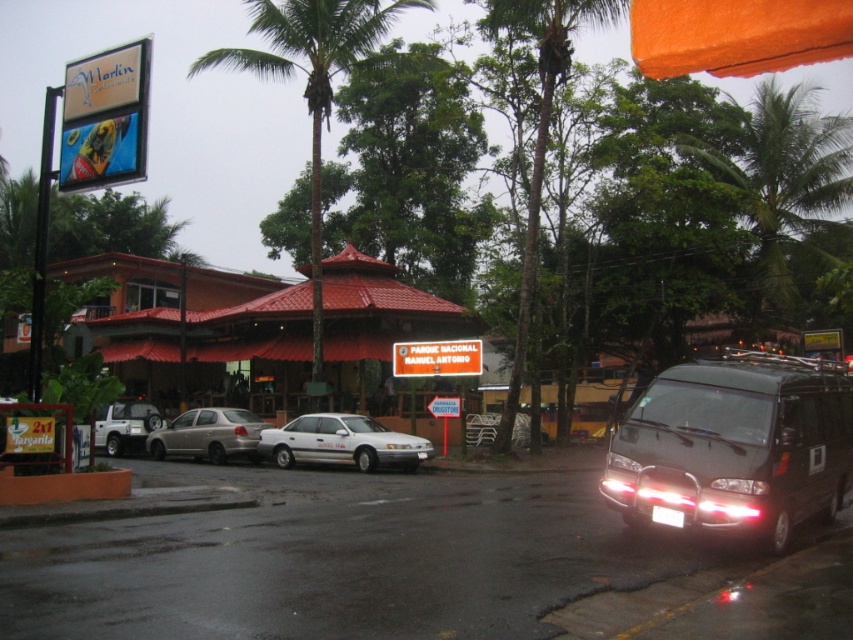
Can you confirm if green leafy palm tree at upper right is wider than satin silver sedan at center?

Yes, green leafy palm tree at upper right is wider than satin silver sedan at center.

Does green leafy palm tree at upper right have a greater height compared to satin silver sedan at center?

Correct, green leafy palm tree at upper right is much taller as satin silver sedan at center.

Image resolution: width=853 pixels, height=640 pixels. What do you see at coordinates (788, 192) in the screenshot?
I see `green leafy palm tree at upper right` at bounding box center [788, 192].

Where is `green leafy palm tree at upper right`? green leafy palm tree at upper right is located at coordinates (788, 192).

This screenshot has height=640, width=853. Describe the element at coordinates (207, 435) in the screenshot. I see `satin silver sedan at center` at that location.

The image size is (853, 640). I want to click on satin silver sedan at center, so click(207, 435).

At what (x,y) coordinates should I click in order to perform the action: click on satin silver sedan at center. Please return your answer as a coordinate pair (x, y). This screenshot has width=853, height=640. Looking at the image, I should click on (207, 435).

Is black matte van at right smaller than silver metallic suv at center-left?

No, black matte van at right is not smaller than silver metallic suv at center-left.

Does black matte van at right come behind silver metallic suv at center-left?

No, it is in front of silver metallic suv at center-left.

The height and width of the screenshot is (640, 853). Identify the location of black matte van at right. (735, 445).

At what (x,y) coordinates should I click in order to perform the action: click on black matte van at right. Please return your answer as a coordinate pair (x, y). Looking at the image, I should click on (735, 445).